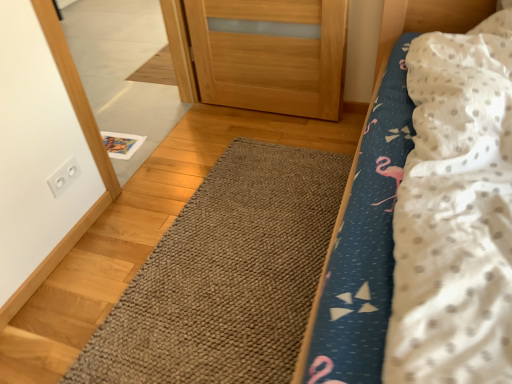
This screenshot has width=512, height=384. Describe the element at coordinates (63, 177) in the screenshot. I see `white plastic outlet at upper left` at that location.

What do you see at coordinates (125, 71) in the screenshot? I see `white glossy mirror at upper left` at bounding box center [125, 71].

In order to face white glossy mirror at upper left, should I rotate leftwards or rightwards?

Rotate left and turn 16.359 degrees.

What do you see at coordinates (226, 276) in the screenshot?
I see `brown textured rug at center` at bounding box center [226, 276].

What are the coordinates of `white plastic outlet at upper left` in the screenshot? It's located at 63,177.

Which of these two, brown textured rug at center or fluffy fabric bed at center, is smaller?

Smaller between the two is brown textured rug at center.

From the image's perspective, between brown textured rug at center and fluffy fabric bed at center, who is located below?

brown textured rug at center.

Is brown textured rug at center far from fluffy fabric bed at center?

No.

Is brown textured rug at center positioned behind fluffy fabric bed at center?

Yes, brown textured rug at center is behind fluffy fabric bed at center.

Could you tell me if white plastic outlet at upper left is facing brown textured rug at center?

No, white plastic outlet at upper left is not oriented towards brown textured rug at center.

Between white plastic outlet at upper left and brown textured rug at center, which one has less height?

Standing shorter between the two is brown textured rug at center.

Does point (60, 167) come behind point (224, 220)?

No, it is not.

Is white plastic outlet at upper left situated inside brown textured rug at center or outside?

A: The correct answer is: outside.

Considering the positions of objects fluffy fabric bed at center and white glossy mirror at upper left in the image provided, who is more to the right, fluffy fabric bed at center or white glossy mirror at upper left?

Positioned to the right is fluffy fabric bed at center.

Would you say fluffy fabric bed at center is outside white glossy mirror at upper left?

Yes.

Considering the positions of objects fluffy fabric bed at center and white glossy mirror at upper left in the image provided, who is in front, fluffy fabric bed at center or white glossy mirror at upper left?

fluffy fabric bed at center is closer to the camera.

From their relative heights in the image, would you say fluffy fabric bed at center is taller or shorter than white glossy mirror at upper left?

Considering their sizes, fluffy fabric bed at center has more height than white glossy mirror at upper left.

From a real-world perspective, is white glossy mirror at upper left located beneath brown textured rug at center?

No, from a real-world perspective, white glossy mirror at upper left is not under brown textured rug at center.

Which of these two, white glossy mirror at upper left or brown textured rug at center, is wider?

With larger width is brown textured rug at center.

Could you tell me if white glossy mirror at upper left is turned towards brown textured rug at center?

Yes, white glossy mirror at upper left is oriented towards brown textured rug at center.

Is point (104, 115) farther from camera compared to point (273, 354)?

Yes.

Who is taller, white plastic outlet at upper left or fluffy fabric bed at center?

fluffy fabric bed at center.

Does white plastic outlet at upper left turn towards fluffy fabric bed at center?

Yes, white plastic outlet at upper left faces towards fluffy fabric bed at center.

Considering the sizes of white plastic outlet at upper left and fluffy fabric bed at center in the image, is white plastic outlet at upper left bigger or smaller than fluffy fabric bed at center?

Considering their sizes, white plastic outlet at upper left takes up less space than fluffy fabric bed at center.

Is white plastic outlet at upper left touching fluffy fabric bed at center?

No, white plastic outlet at upper left is not touching fluffy fabric bed at center.

Is white glossy mirror at upper left surrounding white plastic outlet at upper left?

No, white plastic outlet at upper left is located outside of white glossy mirror at upper left.

Is white glossy mirror at upper left beside white plastic outlet at upper left?

white glossy mirror at upper left and white plastic outlet at upper left are clearly separated.

Is white glossy mirror at upper left facing away from fluffy fabric bed at center?

That's not correct — white glossy mirror at upper left is not looking away from fluffy fabric bed at center.

Are white glossy mirror at upper left and fluffy fabric bed at center located far from each other?

white glossy mirror at upper left is positioned a significant distance from fluffy fabric bed at center.

Is white glossy mirror at upper left positioned beyond the bounds of fluffy fabric bed at center?

white glossy mirror at upper left is positioned outside fluffy fabric bed at center.

Between white glossy mirror at upper left and fluffy fabric bed at center, which one has less height?

white glossy mirror at upper left.

Image resolution: width=512 pixels, height=384 pixels. Find the location of `doormat behind the fluffy fabric bed at center`. doormat behind the fluffy fabric bed at center is located at coordinates (226, 276).

You are a GUI agent. You are given a task and a screenshot of the screen. Output one action in this format:
    pyautogui.click(x=<x>, y=<y>)
    Task: Click on the doormat that is on the right side of white plastic outlet at upper left
    
    Given the screenshot: What is the action you would take?
    click(x=226, y=276)

In the scene shown: When comparing their distances from brown textured rug at center, does white glossy mirror at upper left or fluffy fabric bed at center seem further?

white glossy mirror at upper left lies further to brown textured rug at center than the other object.

Which object lies further to the anchor point fluffy fabric bed at center, brown textured rug at center or white plastic outlet at upper left?

white plastic outlet at upper left lies further to fluffy fabric bed at center than the other object.

Which object lies further to the anchor point fluffy fabric bed at center, white glossy mirror at upper left or white plastic outlet at upper left?

white glossy mirror at upper left lies further to fluffy fabric bed at center than the other object.

When comparing their distances from white glossy mirror at upper left, does brown textured rug at center or white plastic outlet at upper left seem further?

white plastic outlet at upper left.

When comparing their distances from white glossy mirror at upper left, does white plastic outlet at upper left or fluffy fabric bed at center seem further?

The object further to white glossy mirror at upper left is fluffy fabric bed at center.

Looking at the image, which one is located closer to white plastic outlet at upper left, brown textured rug at center or white glossy mirror at upper left?

brown textured rug at center.

Based on the photo, looking at the image, which one is located further to white plastic outlet at upper left, fluffy fabric bed at center or white glossy mirror at upper left?

Based on the image, white glossy mirror at upper left appears to be further to white plastic outlet at upper left.

Looking at the image, which one is located closer to brown textured rug at center, white glossy mirror at upper left or white plastic outlet at upper left?

Among the two, white plastic outlet at upper left is located nearer to brown textured rug at center.

You are a GUI agent. You are given a task and a screenshot of the screen. Output one action in this format:
    pyautogui.click(x=<x>, y=<y>)
    Task: Click on the doormat positioned between fluffy fabric bed at center and white plastic outlet at upper left from near to far
    The image size is (512, 384).
    Given the screenshot: What is the action you would take?
    pyautogui.click(x=226, y=276)

Find the location of a particular element. The width and height of the screenshot is (512, 384). doormat between fluffy fabric bed at center and white glossy mirror at upper left in the front-back direction is located at coordinates (226, 276).

You are a GUI agent. You are given a task and a screenshot of the screen. Output one action in this format:
    pyautogui.click(x=<x>, y=<y>)
    Task: Click on the mirror positioned between fluffy fabric bed at center and white plastic outlet at upper left from near to far
    
    Given the screenshot: What is the action you would take?
    pyautogui.click(x=125, y=71)

I want to click on electric outlet between white glossy mirror at upper left and brown textured rug at center vertically, so click(63, 177).